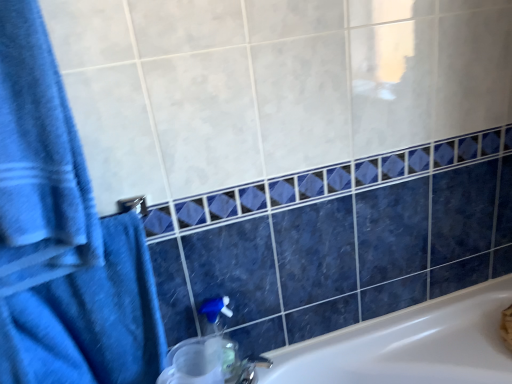
Question: Considering their positions, is blue fabric towel at left, arranged as the first bath towel when ordered from the bottom, located in front of or behind blue cotton towel at left, the 2th bath towel in the bottom-to-top sequence?

Choices:
 (A) behind
 (B) front

Answer: (A)

Question: Considering the positions of blue fabric towel at left, arranged as the first bath towel when ordered from the bottom, and blue cotton towel at left, the 2th bath towel in the bottom-to-top sequence, in the image, is blue fabric towel at left, arranged as the first bath towel when ordered from the bottom, taller or shorter than blue cotton towel at left, the 2th bath towel in the bottom-to-top sequence,?

Choices:
 (A) short
 (B) tall

Answer: (A)

Question: Estimate the real-world distances between objects in this image. Which object is farther from the blue cotton towel at left, the 1th bath towel in the top-to-bottom sequence?

Choices:
 (A) translucent plastic soap dispenser at lower center
 (B) blue fabric towel at left, arranged as the first bath towel when ordered from the bottom

Answer: (A)

Question: Which object is the closest to the blue fabric towel at left, arranged as the first bath towel when ordered from the bottom?

Choices:
 (A) translucent plastic soap dispenser at lower center
 (B) blue cotton towel at left, the 2th bath towel in the bottom-to-top sequence

Answer: (B)